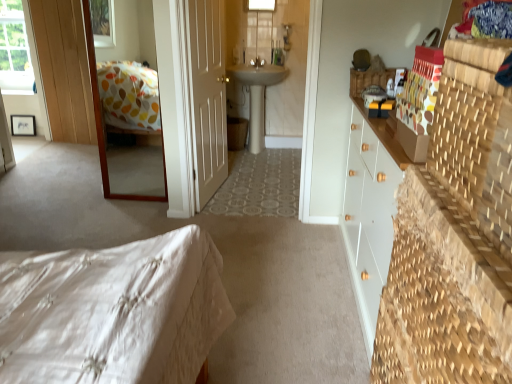
The height and width of the screenshot is (384, 512). What are the coordinates of `blank area beneath white matte door at center (from a real-world perspective)` in the screenshot? It's located at (212, 196).